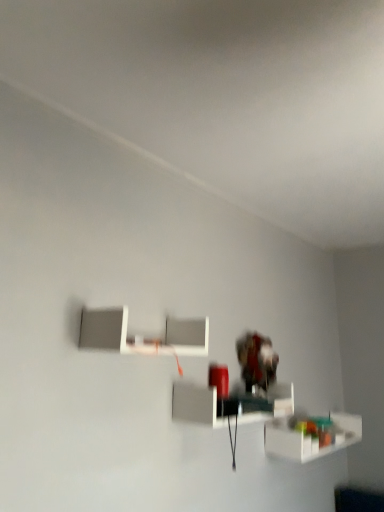
This screenshot has height=512, width=384. What do you see at coordinates (310, 438) in the screenshot?
I see `translucent plastic shelf at lower right, positioned as the third shelf in top-to-bottom order` at bounding box center [310, 438].

The width and height of the screenshot is (384, 512). I want to click on translucent plastic shelf at lower right, which is the 1th shelf in right-to-left order, so click(x=310, y=438).

From a real-world perspective, is white glossy shelf at center, the 2th shelf positioned from the left, on translucent plastic shelf at lower right, arranged as the 3th shelf when viewed from the left?

Yes, from a real-world perspective, white glossy shelf at center, the 2th shelf positioned from the left, is on top of translucent plastic shelf at lower right, arranged as the 3th shelf when viewed from the left.

Would you say white glossy shelf at center, which is counted as the second shelf, starting from the bottom, contains translucent plastic shelf at lower right, which is the 1th shelf in right-to-left order?

Actually, translucent plastic shelf at lower right, which is the 1th shelf in right-to-left order, is outside white glossy shelf at center, which is counted as the second shelf, starting from the bottom.

From the image's perspective, is white glossy shelf at center, the 2th shelf positioned from the left, over translucent plastic shelf at lower right, placed as the first shelf when sorted from bottom to top?

Yes, from the image's perspective, white glossy shelf at center, the 2th shelf positioned from the left, is on top of translucent plastic shelf at lower right, placed as the first shelf when sorted from bottom to top.

Image resolution: width=384 pixels, height=512 pixels. I want to click on the 1st shelf positioned above the translucent plastic shelf at lower right, positioned as the third shelf in top-to-bottom order (from a real-world perspective), so click(229, 404).

From the image's perspective, would you say white matte shelf at upper center, the 1th shelf positioned from the left, is positioned over translucent plastic shelf at lower right, positioned as the third shelf in top-to-bottom order?

Yes.

Is white matte shelf at upper center, the 1th shelf viewed from the top, to the right of translucent plastic shelf at lower right, which is the 1th shelf in right-to-left order, from the viewer's perspective?

No.

Considering the relative sizes of white matte shelf at upper center, which is the 3th shelf in right-to-left order, and translucent plastic shelf at lower right, positioned as the third shelf in top-to-bottom order, in the image provided, is white matte shelf at upper center, which is the 3th shelf in right-to-left order, wider than translucent plastic shelf at lower right, positioned as the third shelf in top-to-bottom order,?

Yes.

Is point (109, 317) positioned behind point (326, 430)?

No, (109, 317) is closer to viewer.

Can you confirm if white matte shelf at upper center, the 1th shelf viewed from the top, is positioned to the left of white glossy shelf at center, which is counted as the second shelf, starting from the bottom?

Yes.

Measure the distance from white matte shelf at upper center, the 1th shelf viewed from the top, to white glossy shelf at center, the 2th shelf positioned from the left.

12.02 inches.

Does white matte shelf at upper center, the third shelf when ordered from bottom to top, have a greater width compared to white glossy shelf at center, which is counted as the second shelf, starting from the bottom?

Incorrect, the width of white matte shelf at upper center, the third shelf when ordered from bottom to top, does not surpass that of white glossy shelf at center, which is counted as the second shelf, starting from the bottom.

Is white matte shelf at upper center, which is the 3th shelf in right-to-left order, completely or partially outside of white glossy shelf at center, arranged as the 2th shelf when viewed from the right?

That's correct, white matte shelf at upper center, which is the 3th shelf in right-to-left order, is outside of white glossy shelf at center, arranged as the 2th shelf when viewed from the right.

Looking at this image, what's the angular difference between translucent plastic shelf at lower right, arranged as the 3th shelf when viewed from the left, and white matte shelf at upper center, which is the 3th shelf in right-to-left order,'s facing directions?

translucent plastic shelf at lower right, arranged as the 3th shelf when viewed from the left, and white matte shelf at upper center, which is the 3th shelf in right-to-left order, are facing 0.114 degrees away from each other.

Locate an element on the screen. the 2nd shelf counting from the right of the white matte shelf at upper center, the third shelf when ordered from bottom to top is located at coordinates (310, 438).

Is translucent plastic shelf at lower right, arranged as the 3th shelf when viewed from the left, completely or partially outside of white matte shelf at upper center, the 1th shelf viewed from the top?

Yes, translucent plastic shelf at lower right, arranged as the 3th shelf when viewed from the left, is located beyond the bounds of white matte shelf at upper center, the 1th shelf viewed from the top.

Based on the photo, does translucent plastic shelf at lower right, arranged as the 3th shelf when viewed from the left, have a lesser width compared to white matte shelf at upper center, which is the 3th shelf in right-to-left order?

Yes, translucent plastic shelf at lower right, arranged as the 3th shelf when viewed from the left, is thinner than white matte shelf at upper center, which is the 3th shelf in right-to-left order.

Could you measure the distance between translucent plastic shelf at lower right, which is the 1th shelf in right-to-left order, and white glossy shelf at center, the 2th shelf positioned from the left?

translucent plastic shelf at lower right, which is the 1th shelf in right-to-left order, is 16.59 inches away from white glossy shelf at center, the 2th shelf positioned from the left.

From the image's perspective, which one is positioned higher, translucent plastic shelf at lower right, placed as the first shelf when sorted from bottom to top, or white glossy shelf at center, which is counted as the second shelf, starting from the bottom?

From the image's view, white glossy shelf at center, which is counted as the second shelf, starting from the bottom, is above.

From a real-world perspective, is translucent plastic shelf at lower right, arranged as the 3th shelf when viewed from the left, below white glossy shelf at center, arranged as the 2th shelf when viewed from the right?

Yes, from a real-world perspective, translucent plastic shelf at lower right, arranged as the 3th shelf when viewed from the left, is beneath white glossy shelf at center, arranged as the 2th shelf when viewed from the right.

Looking at this image, in terms of width, does translucent plastic shelf at lower right, which is the 1th shelf in right-to-left order, look wider or thinner when compared to white glossy shelf at center, the 2th shelf positioned from the left?

In the image, translucent plastic shelf at lower right, which is the 1th shelf in right-to-left order, appears to be more narrow than white glossy shelf at center, the 2th shelf positioned from the left.

From a real-world perspective, is white glossy shelf at center, which appears as the second shelf when viewed from the top, positioned under white matte shelf at upper center, the 1th shelf viewed from the top, based on gravity?

Correct, in the physical world, white glossy shelf at center, which appears as the second shelf when viewed from the top, is lower than white matte shelf at upper center, the 1th shelf viewed from the top.

Is white glossy shelf at center, arranged as the 2th shelf when viewed from the right, bigger than white matte shelf at upper center, the 1th shelf positioned from the left?

Yes.

Considering the sizes of objects white glossy shelf at center, arranged as the 2th shelf when viewed from the right, and white matte shelf at upper center, the 1th shelf positioned from the left, in the image provided, who is thinner, white glossy shelf at center, arranged as the 2th shelf when viewed from the right, or white matte shelf at upper center, the 1th shelf positioned from the left,?

white matte shelf at upper center, the 1th shelf positioned from the left, is thinner.

From the image's perspective, is white glossy shelf at center, arranged as the 2th shelf when viewed from the right, below white matte shelf at upper center, the 1th shelf viewed from the top?

Yes, from the image's perspective, white glossy shelf at center, arranged as the 2th shelf when viewed from the right, is beneath white matte shelf at upper center, the 1th shelf viewed from the top.

Locate an element on the screen. The width and height of the screenshot is (384, 512). the 1st shelf located above the translucent plastic shelf at lower right, placed as the first shelf when sorted from bottom to top (from a real-world perspective) is located at coordinates (229, 404).

There is a white matte shelf at upper center, the third shelf when ordered from bottom to top. At what (x,y) coordinates should I click in order to perform the action: click on the 2nd shelf below it (from the image's perspective). Please return your answer as a coordinate pair (x, y). This screenshot has width=384, height=512. Looking at the image, I should click on (310, 438).

Estimate the real-world distances between objects in this image. Which object is closer to translucent plastic shelf at lower right, positioned as the third shelf in top-to-bottom order, white matte shelf at upper center, the 1th shelf positioned from the left, or white glossy shelf at center, arranged as the 2th shelf when viewed from the right?

Among the two, white glossy shelf at center, arranged as the 2th shelf when viewed from the right, is located nearer to translucent plastic shelf at lower right, positioned as the third shelf in top-to-bottom order.

Considering their positions, is white glossy shelf at center, which is counted as the second shelf, starting from the bottom, positioned closer to white matte shelf at upper center, the third shelf when ordered from bottom to top, than translucent plastic shelf at lower right, positioned as the third shelf in top-to-bottom order?

white glossy shelf at center, which is counted as the second shelf, starting from the bottom, is closer to white matte shelf at upper center, the third shelf when ordered from bottom to top.

Which object lies further to the anchor point white matte shelf at upper center, the 1th shelf positioned from the left, translucent plastic shelf at lower right, arranged as the 3th shelf when viewed from the left, or white glossy shelf at center, the 2th shelf positioned from the left?

translucent plastic shelf at lower right, arranged as the 3th shelf when viewed from the left, lies further to white matte shelf at upper center, the 1th shelf positioned from the left, than the other object.

Estimate the real-world distances between objects in this image. Which object is closer to white glossy shelf at center, which appears as the second shelf when viewed from the top, white matte shelf at upper center, which is the 3th shelf in right-to-left order, or translucent plastic shelf at lower right, placed as the first shelf when sorted from bottom to top?

The object closer to white glossy shelf at center, which appears as the second shelf when viewed from the top, is white matte shelf at upper center, which is the 3th shelf in right-to-left order.

Which object lies nearer to the anchor point translucent plastic shelf at lower right, positioned as the third shelf in top-to-bottom order, white glossy shelf at center, which appears as the second shelf when viewed from the top, or white matte shelf at upper center, which is the 3th shelf in right-to-left order?

Among the two, white glossy shelf at center, which appears as the second shelf when viewed from the top, is located nearer to translucent plastic shelf at lower right, positioned as the third shelf in top-to-bottom order.

From the image, which object appears to be farther from white glossy shelf at center, which appears as the second shelf when viewed from the top, translucent plastic shelf at lower right, placed as the first shelf when sorted from bottom to top, or white matte shelf at upper center, the third shelf when ordered from bottom to top?

translucent plastic shelf at lower right, placed as the first shelf when sorted from bottom to top.

The height and width of the screenshot is (512, 384). Identify the location of shelf located between white matte shelf at upper center, the third shelf when ordered from bottom to top, and translucent plastic shelf at lower right, which is the 1th shelf in right-to-left order, in the left-right direction. (229, 404).